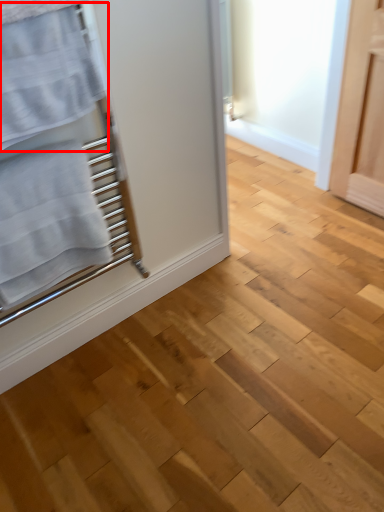
Question: From the image's perspective, where is bath towel (annotated by the red box) located relative to bath towel?

Choices:
 (A) below
 (B) above

Answer: (B)